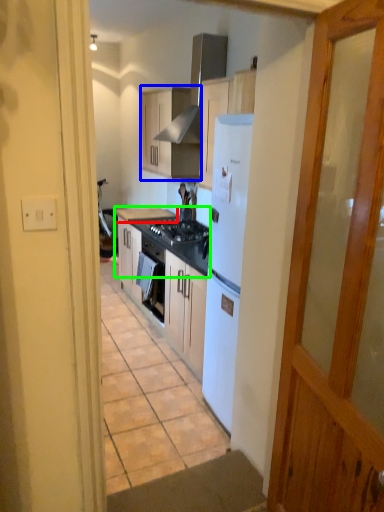
Question: Estimate the real-world distances between objects in this image. Which object is farther from countertop (highlighted by a red box), cabinetry (highlighted by a blue box) or countertop (highlighted by a green box)?

Choices:
 (A) cabinetry
 (B) countertop

Answer: (A)